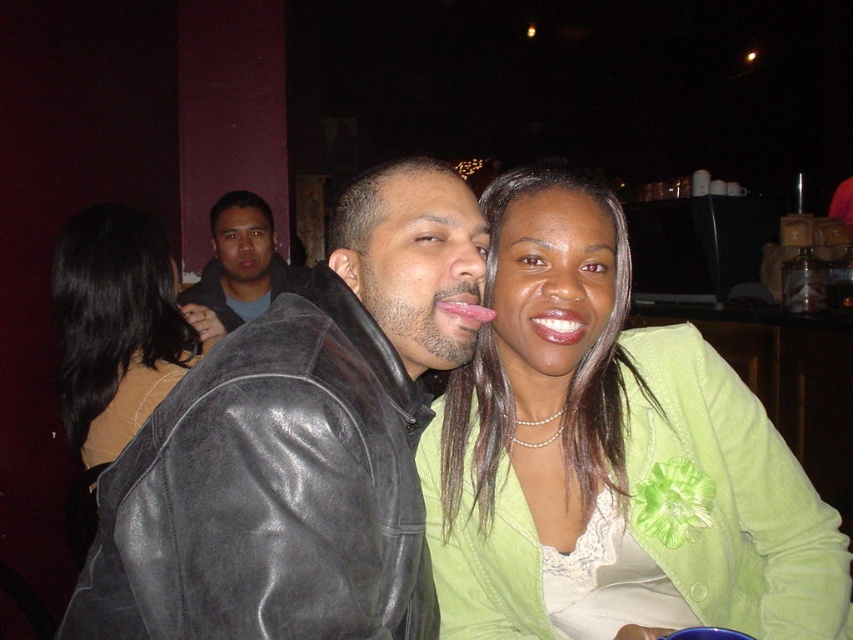
Question: Which of the following is the closest to the observer?

Choices:
 (A) (465, 308)
 (B) (392, 230)
 (C) (53, 262)
 (D) (540, 310)

Answer: (B)

Question: Is black leather jacket at center positioned in front of matte black jacket at upper center?

Choices:
 (A) yes
 (B) no

Answer: (A)

Question: Which object is closer to the camera taking this photo?

Choices:
 (A) matte black jacket at upper center
 (B) black leather jacket at center
 (C) matte black jacket at left
 (D) glossy pink tongue at center

Answer: (B)

Question: Estimate the real-world distances between objects in this image. Which object is farther from the green fabric jacket at center?

Choices:
 (A) matte pink lips at center
 (B) glossy pink tongue at center
 (C) matte black jacket at upper center

Answer: (C)

Question: Is matte black jacket at left to the left of matte pink lips at center from the viewer's perspective?

Choices:
 (A) no
 (B) yes

Answer: (B)

Question: Can you confirm if black leather jacket at center is positioned above matte black jacket at upper center?

Choices:
 (A) yes
 (B) no

Answer: (B)